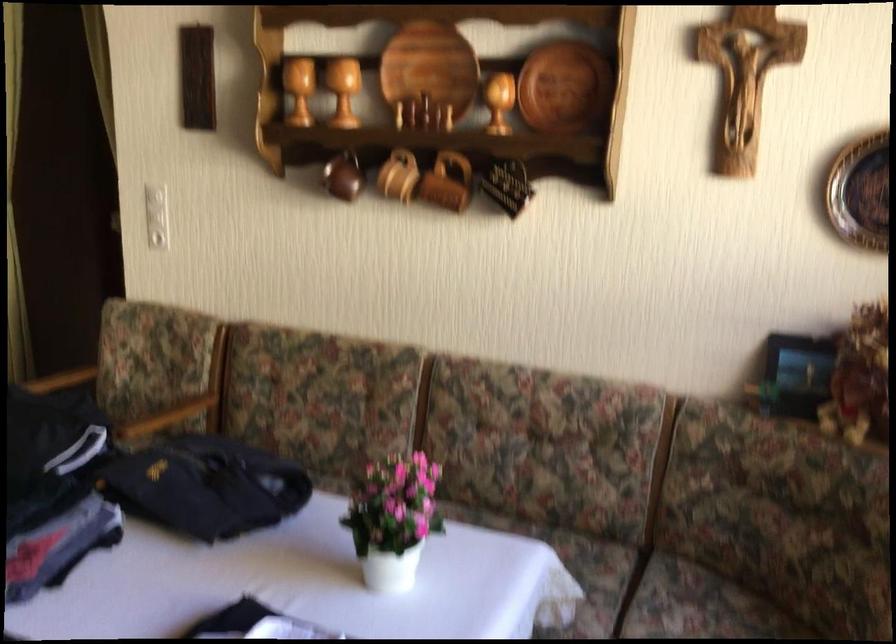
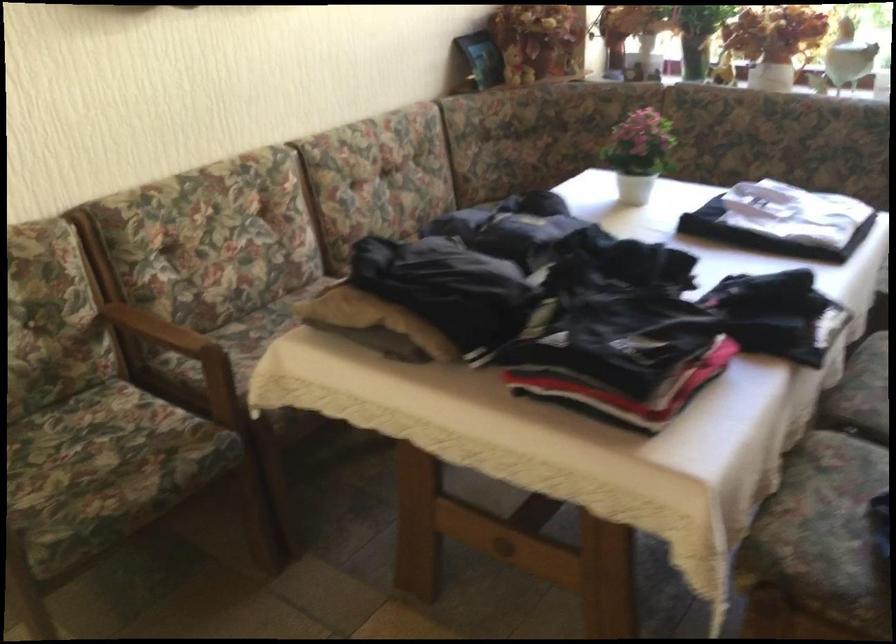
Find the pixel in the second image that matches point (402, 521) in the first image.

(639, 153)